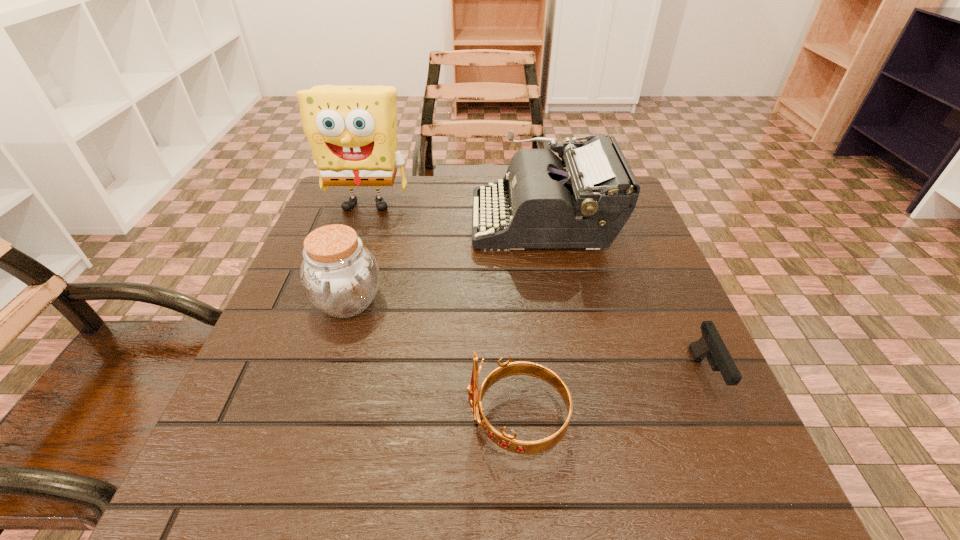
The width and height of the screenshot is (960, 540). In order to click on the tallest object in this screenshot , I will do `click(352, 130)`.

At what (x,y) coordinates should I click in order to perform the action: click on typewriter. Please return your answer as a coordinate pair (x, y). This screenshot has width=960, height=540. Looking at the image, I should click on click(584, 200).

Find the location of a particular element. This screenshot has height=540, width=960. tiara is located at coordinates [x=508, y=442].

You are a GUI agent. You are given a task and a screenshot of the screen. Output one action in this format:
    pyautogui.click(x=<x>, y=<y>)
    Task: Click on the jar
    Image resolution: width=960 pixels, height=540 pixels.
    Given the screenshot: What is the action you would take?
    pyautogui.click(x=339, y=276)

Find the location of a particular element. pistol is located at coordinates (711, 346).

Where is `the shortest object`? The image size is (960, 540). the shortest object is located at coordinates (711, 346).

Where is `vacant space located on the face of the sponge`? Image resolution: width=960 pixels, height=540 pixels. vacant space located on the face of the sponge is located at coordinates (345, 268).

Identify the location of vacant region located on the front-facing side of the typewriter. tap(406, 220).

Where is `vacant space located on the front-facing side of the typewriter`? vacant space located on the front-facing side of the typewriter is located at coordinates (419, 220).

Identify the location of vacant position located on the front-facing side of the typewriter. Image resolution: width=960 pixels, height=540 pixels. (320, 220).